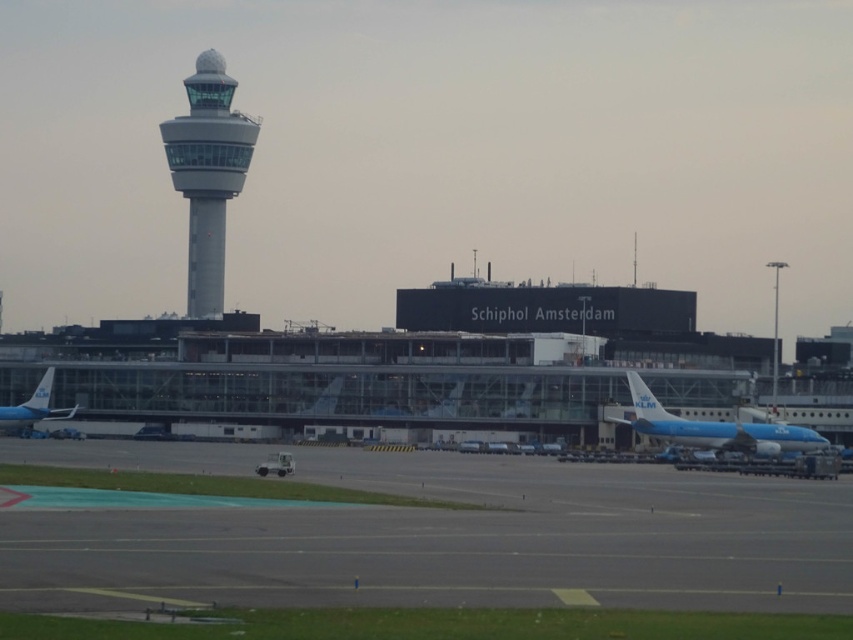
Does gray asphalt tarmac at lower center come in front of blue painted airplane at lower left?

That is True.

Who is lower down, gray asphalt tarmac at lower center or blue painted airplane at lower left?

Positioned lower is blue painted airplane at lower left.

Who is more distant from viewer, (x=685, y=592) or (x=4, y=428)?

The point (x=4, y=428) is behind.

What are the coordinates of `gray asphalt tarmac at lower center` in the screenshot? It's located at (454, 541).

Which is in front, point (138, 602) or point (775, 429)?

Point (138, 602) is in front.

Based on the photo, is the position of gray asphalt tarmac at lower center less distant than that of blue metallic airplane at lower right?

Yes, it is in front of blue metallic airplane at lower right.

Is point (786, 588) positioned in front of point (740, 436)?

Yes.

The width and height of the screenshot is (853, 640). Identify the location of gray asphalt tarmac at lower center. (454, 541).

Who is shorter, glassy gray control tower at upper left or blue painted airplane at lower left?

blue painted airplane at lower left is shorter.

Does glassy gray control tower at upper left lie behind blue painted airplane at lower left?

Yes, it is.

Is point (210, 84) farther from viewer compared to point (39, 408)?

Yes, point (210, 84) is behind point (39, 408).

This screenshot has width=853, height=640. What are the coordinates of `glassy gray control tower at upper left` in the screenshot? It's located at (207, 173).